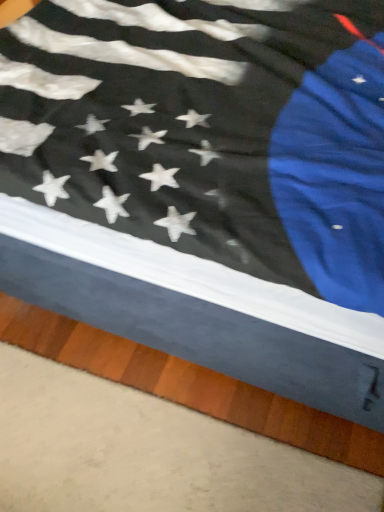
I want to click on empty space that is ontop of smooth wood plank at lower right (from a real-world perspective), so click(132, 456).